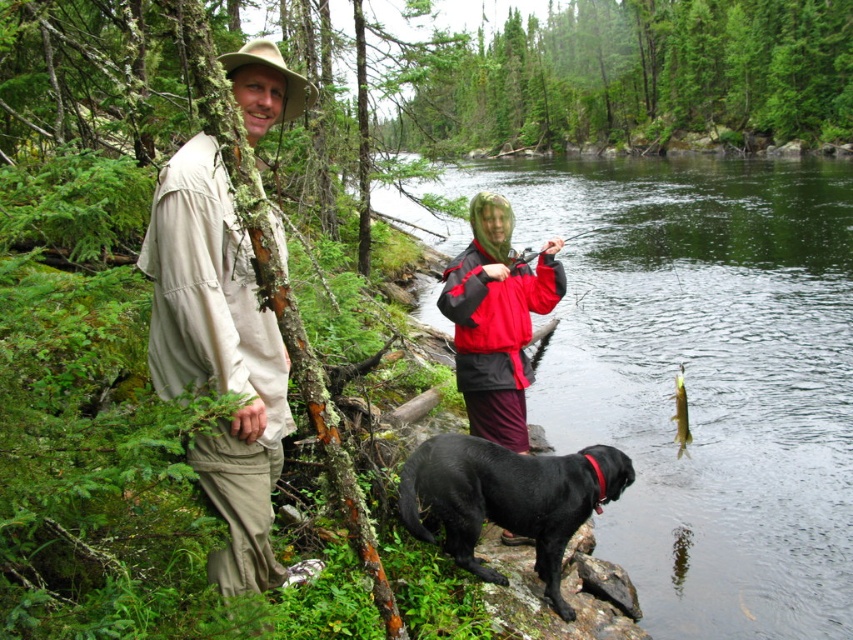
What is located at the coordinates point (218, 355)?

The tan fabric shirt at left is located at point (218, 355).

What is the exact coordinate position of the black matte dog at lower center in the image?

The black matte dog at lower center is located at point (508, 499).